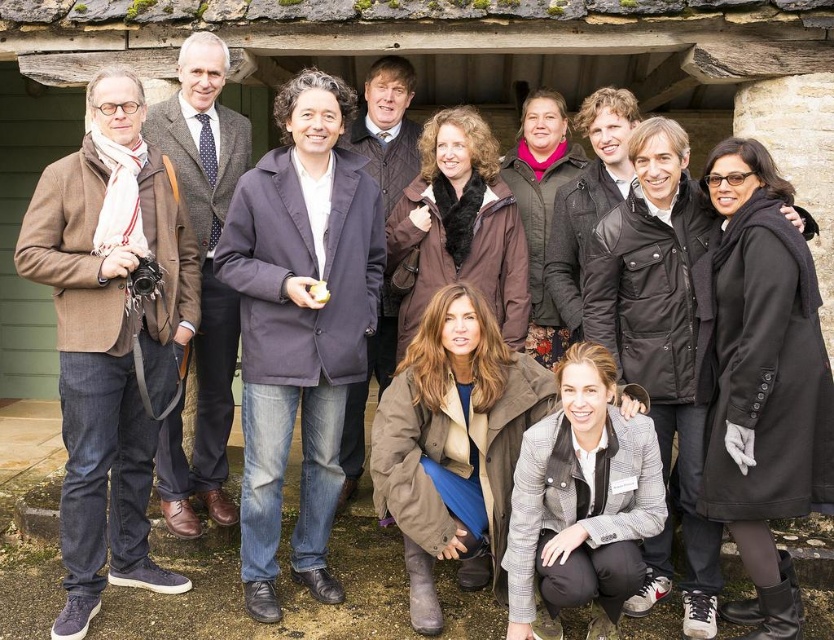
Question: Which is farther from the brown woolen coat at left?

Choices:
 (A) brown woolen jacket at left
 (B) dark blue jacket at center
 (C) black wool coat at center-right
 (D) plaid wool jacket at lower center

Answer: (C)

Question: Can you confirm if dark blue jacket at center is positioned below black wool coat at center-right?

Choices:
 (A) no
 (B) yes

Answer: (A)

Question: Among these points, which one is nearest to the camera?

Choices:
 (A) (137, 113)
 (B) (780, 448)
 (C) (505, 634)
 (D) (214, 108)

Answer: (B)

Question: Observing the image, what is the correct spatial positioning of black wool coat at center-right in reference to brown woolen coat at left?

Choices:
 (A) below
 (B) above

Answer: (A)

Question: Which object is farther from the camera taking this photo?

Choices:
 (A) plaid wool jacket at lower center
 (B) brown woolen jacket at left

Answer: (B)

Question: Observing the image, what is the correct spatial positioning of black wool coat at center-right in reference to plaid wool jacket at lower center?

Choices:
 (A) left
 (B) right

Answer: (B)